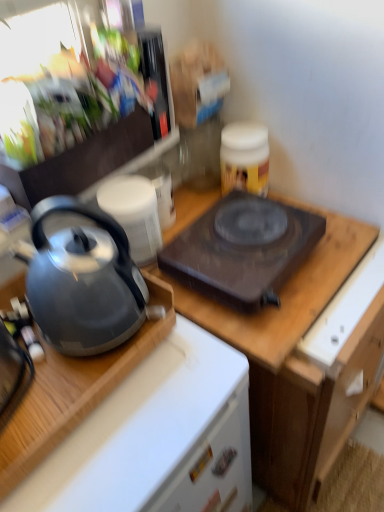
Question: Is satin silver kettle at left in contact with white matte drawer at lower center?

Choices:
 (A) yes
 (B) no

Answer: (B)

Question: Is satin silver kettle at left in front of white matte drawer at lower center?

Choices:
 (A) no
 (B) yes

Answer: (B)

Question: Can you confirm if satin silver kettle at left is positioned to the left of white matte drawer at lower center?

Choices:
 (A) yes
 (B) no

Answer: (A)

Question: Is satin silver kettle at left located outside white matte drawer at lower center?

Choices:
 (A) no
 (B) yes

Answer: (B)

Question: Considering the relative positions of satin silver kettle at left and white matte drawer at lower center in the image provided, is satin silver kettle at left to the right of white matte drawer at lower center from the viewer's perspective?

Choices:
 (A) no
 (B) yes

Answer: (A)

Question: Choose the correct answer: Is matte gray kettle at left inside wooden cutting board at upper center or outside it?

Choices:
 (A) inside
 (B) outside

Answer: (B)

Question: Relative to wooden cutting board at upper center, is matte gray kettle at left in front or behind?

Choices:
 (A) front
 (B) behind

Answer: (A)

Question: Is point (56, 229) closer or farther from the camera than point (266, 482)?

Choices:
 (A) closer
 (B) farther

Answer: (A)

Question: From a real-world perspective, relative to wooden cutting board at upper center, is matte gray kettle at left vertically above or below?

Choices:
 (A) below
 (B) above

Answer: (B)

Question: Would you say shiny metallic kettle at left, which appears as the 1th appliance when ordered from the bottom, is inside or outside satin silver kettle at left?

Choices:
 (A) inside
 (B) outside

Answer: (B)

Question: In terms of width, does shiny metallic kettle at left, the 2th appliance positioned from the top, look wider or thinner when compared to satin silver kettle at left?

Choices:
 (A) wide
 (B) thin

Answer: (B)

Question: Considering the positions of point [x=140, y=182] and point [x=120, y=360], is point [x=140, y=182] closer or farther from the camera than point [x=120, y=360]?

Choices:
 (A) closer
 (B) farther

Answer: (B)

Question: Would you say shiny metallic kettle at left, which appears as the 1th appliance when ordered from the bottom, is to the left or to the right of satin silver kettle at left in the picture?

Choices:
 (A) right
 (B) left

Answer: (A)

Question: Is point (125, 209) closer or farther from the camera than point (352, 245)?

Choices:
 (A) farther
 (B) closer

Answer: (B)

Question: In terms of height, does shiny metallic kettle at left, the 2th appliance positioned from the top, look taller or shorter compared to wooden cutting board at upper center?

Choices:
 (A) tall
 (B) short

Answer: (B)